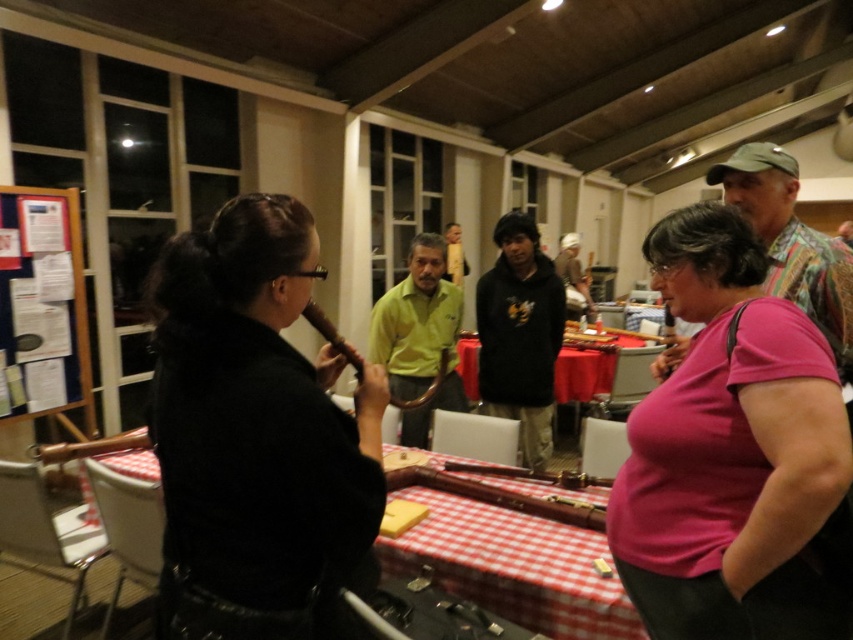
Question: Is pink fabric shirt at center positioned in front of brown wood flute at center?

Choices:
 (A) no
 (B) yes

Answer: (B)

Question: Which object is the closest to the paperboard noticeboard at left?

Choices:
 (A) brown wood flute at center
 (B) yellow matte shirt at center

Answer: (B)

Question: Which object is positioned closest to the red checkered tablecloth at center?

Choices:
 (A) yellow matte shirt at center
 (B) red tablecloth at center

Answer: (A)

Question: Is black leather jacket at center below red checkered tablecloth at center?

Choices:
 (A) no
 (B) yes

Answer: (A)

Question: Which point is closer to the camera taking this photo?

Choices:
 (A) (593, 355)
 (B) (520, 550)

Answer: (B)

Question: Is yellow matte shirt at center below brown wood flute at center?

Choices:
 (A) no
 (B) yes

Answer: (A)